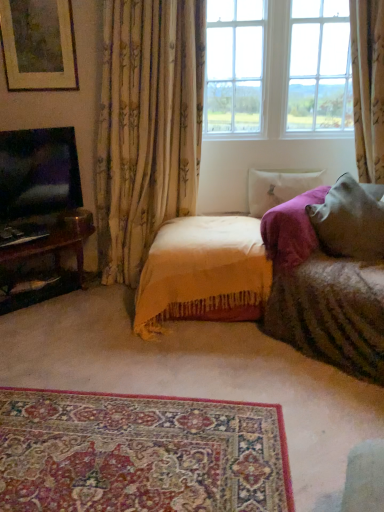
Question: Does floral fabric curtain at left have a lesser height compared to matte gold picture frame at upper left?

Choices:
 (A) no
 (B) yes

Answer: (A)

Question: Is floral fabric curtain at left located outside matte gold picture frame at upper left?

Choices:
 (A) yes
 (B) no

Answer: (A)

Question: Does floral fabric curtain at left contain matte gold picture frame at upper left?

Choices:
 (A) no
 (B) yes

Answer: (A)

Question: Is floral fabric curtain at left wider than matte gold picture frame at upper left?

Choices:
 (A) yes
 (B) no

Answer: (A)

Question: Is floral fabric curtain at left positioned behind matte gold picture frame at upper left?

Choices:
 (A) no
 (B) yes

Answer: (A)

Question: In terms of size, does carpet with intricate patterns at lower center appear bigger or smaller than velvet yellow blanket at center?

Choices:
 (A) big
 (B) small

Answer: (B)

Question: From a real-world perspective, relative to velvet yellow blanket at center, is carpet with intricate patterns at lower center vertically above or below?

Choices:
 (A) above
 (B) below

Answer: (B)

Question: In terms of height, does carpet with intricate patterns at lower center look taller or shorter compared to velvet yellow blanket at center?

Choices:
 (A) short
 (B) tall

Answer: (A)

Question: Is carpet with intricate patterns at lower center wider or thinner than velvet yellow blanket at center?

Choices:
 (A) wide
 (B) thin

Answer: (A)

Question: Is clear glass window at upper center taller or shorter than floral fabric curtain at left?

Choices:
 (A) tall
 (B) short

Answer: (B)

Question: Do you think clear glass window at upper center is within floral fabric curtain at left, or outside of it?

Choices:
 (A) outside
 (B) inside

Answer: (A)

Question: Considering their positions, is clear glass window at upper center located in front of or behind floral fabric curtain at left?

Choices:
 (A) behind
 (B) front

Answer: (A)

Question: From a real-world perspective, relative to floral fabric curtain at left, is clear glass window at upper center vertically above or below?

Choices:
 (A) above
 (B) below

Answer: (A)

Question: Is velvet yellow blanket at center wider or thinner than floral fabric curtain at left?

Choices:
 (A) wide
 (B) thin

Answer: (A)

Question: Is point (244, 302) closer or farther from the camera than point (134, 202)?

Choices:
 (A) closer
 (B) farther

Answer: (A)